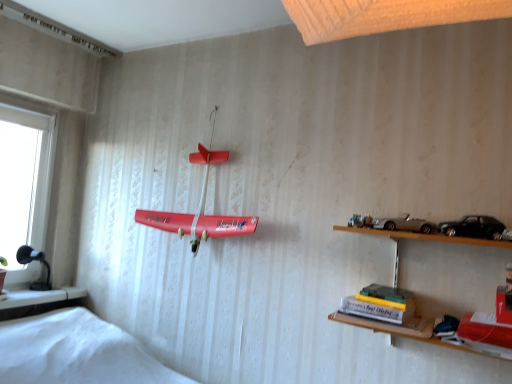
Question: Is black matte toy car at upper right, the 1th toy car when ordered from right to left, taller or shorter than black plastic lamp at lower left?

Choices:
 (A) tall
 (B) short

Answer: (B)

Question: From a real-world perspective, is black matte toy car at upper right, acting as the 1th toy car starting from the front, positioned above or below black plastic lamp at lower left?

Choices:
 (A) above
 (B) below

Answer: (A)

Question: Considering the real-world distances, which object is farthest from the black matte toy car at upper right, the 1th toy car when ordered from right to left?

Choices:
 (A) matte red airplane at center
 (B) hardcover book at lower right
 (C) black plastic lamp at lower left
 (D) silver metallic toy car at upper right, which is the 1th toy car from left to right

Answer: (C)

Question: Based on their relative distances, which object is nearer to the black matte toy car at upper right, the 1th toy car when ordered from right to left?

Choices:
 (A) silver metallic toy car at upper right, arranged as the second toy car when viewed from the right
 (B) black plastic lamp at lower left
 (C) hardcover book at lower right
 (D) matte red airplane at center

Answer: (A)